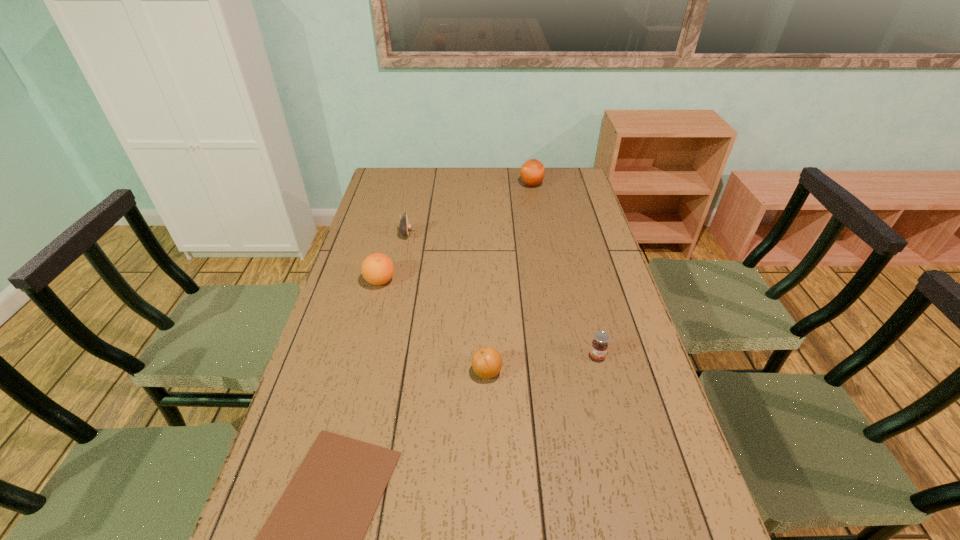
Find the location of a particular element. Image resolution: width=960 pixels, height=540 pixels. vacant region located on the front of the second tallest orange is located at coordinates (368, 329).

At what (x,y) coordinates should I click in order to perform the action: click on free space located on the label side of the jam. Please return your answer as a coordinate pair (x, y). Looking at the image, I should click on (608, 398).

Locate an element on the screen. vacant area situated 0.220m on the right of the second orange from right to left is located at coordinates 585,372.

Find the location of a particular element. The height and width of the screenshot is (540, 960). object located in the far edge section of the desktop is located at coordinates (x=532, y=172).

The height and width of the screenshot is (540, 960). I want to click on avocado that is at the left edge, so click(405, 227).

Where is `orange present at the left edge`? orange present at the left edge is located at coordinates (377, 269).

You are a GUI agent. You are given a task and a screenshot of the screen. Output one action in this format:
    pyautogui.click(x=<x>, y=<y>)
    Task: Click on the object that is at the right edge
    This screenshot has width=960, height=540.
    Given the screenshot: What is the action you would take?
    pyautogui.click(x=599, y=346)

In the image, there is a desktop. Where is `vacant space at the far edge`? vacant space at the far edge is located at coordinates (454, 187).

The height and width of the screenshot is (540, 960). I want to click on blank area at the left edge, so click(x=358, y=323).

Find the location of `free space at the right edge`. free space at the right edge is located at coordinates (561, 244).